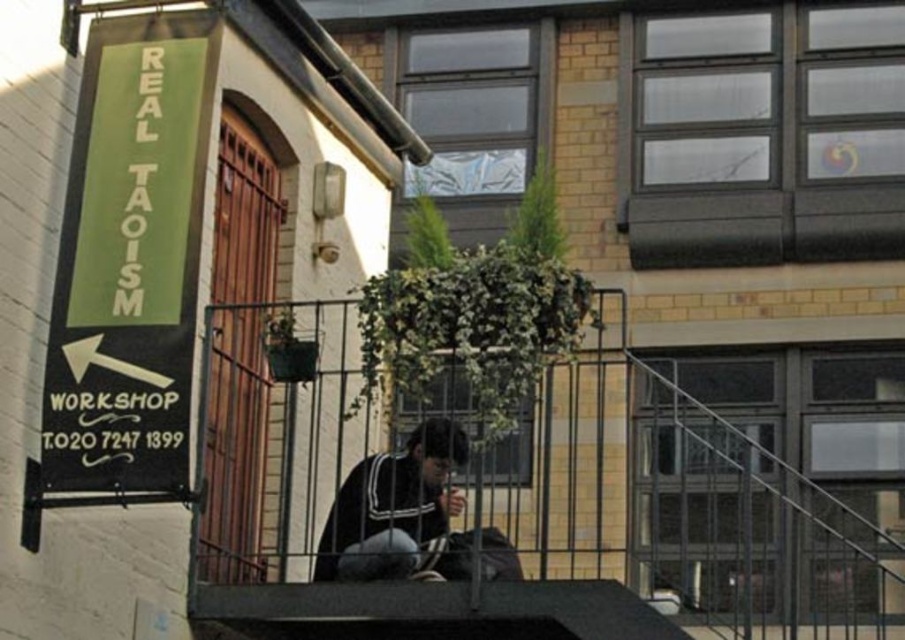
Question: Which object is farther from the camera taking this photo?

Choices:
 (A) metallic gray balcony at center
 (B) dark blue fabric jacket at center

Answer: (B)

Question: Does metallic gray balcony at center have a smaller size compared to dark blue fabric jacket at center?

Choices:
 (A) no
 (B) yes

Answer: (A)

Question: Is green matte sign at upper left positioned at the back of dark blue fabric jacket at center?

Choices:
 (A) yes
 (B) no

Answer: (B)

Question: Among these objects, which one is nearest to the camera?

Choices:
 (A) dark blue fabric jacket at center
 (B) metallic gray balcony at center
 (C) green matte sign at upper left

Answer: (C)

Question: Which is nearer to the dark blue fabric jacket at center?

Choices:
 (A) metallic gray balcony at center
 (B) green matte sign at upper left

Answer: (A)

Question: Is green matte sign at upper left above dark blue fabric jacket at center?

Choices:
 (A) yes
 (B) no

Answer: (A)